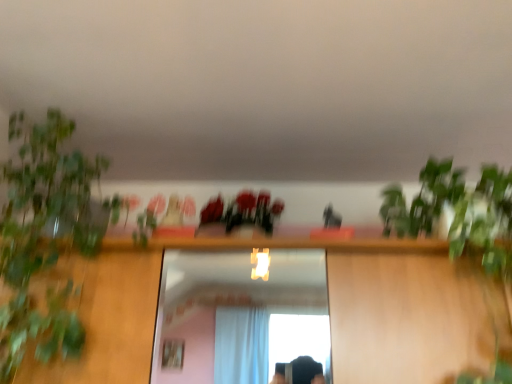
Image resolution: width=512 pixels, height=384 pixels. Identify the location of free space above green leafy plant at left (from a real-world perspective). coord(85,105).